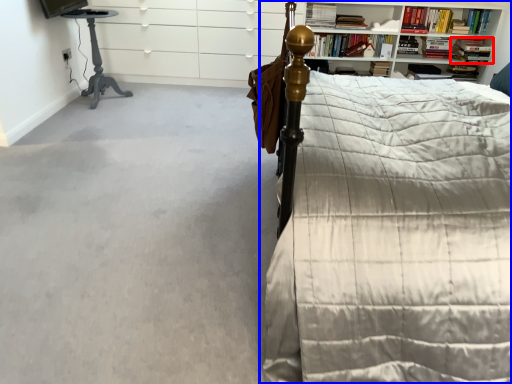
Question: Which of the following is the farthest to the observer, book (highlighted by a red box) or bed (highlighted by a blue box)?

Choices:
 (A) book
 (B) bed

Answer: (A)